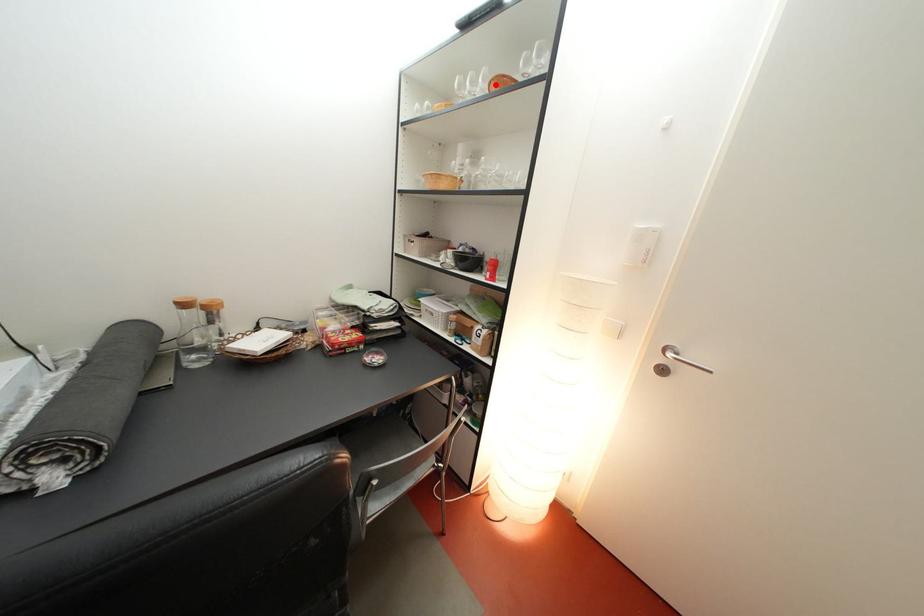
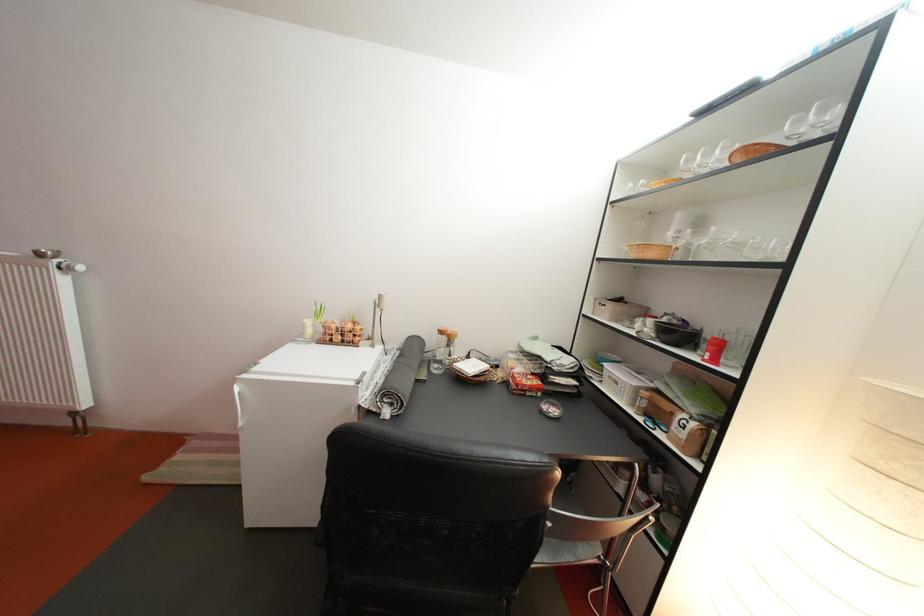
Find the pixel in the second image that matches the highlighted location in the first image.

(734, 156)